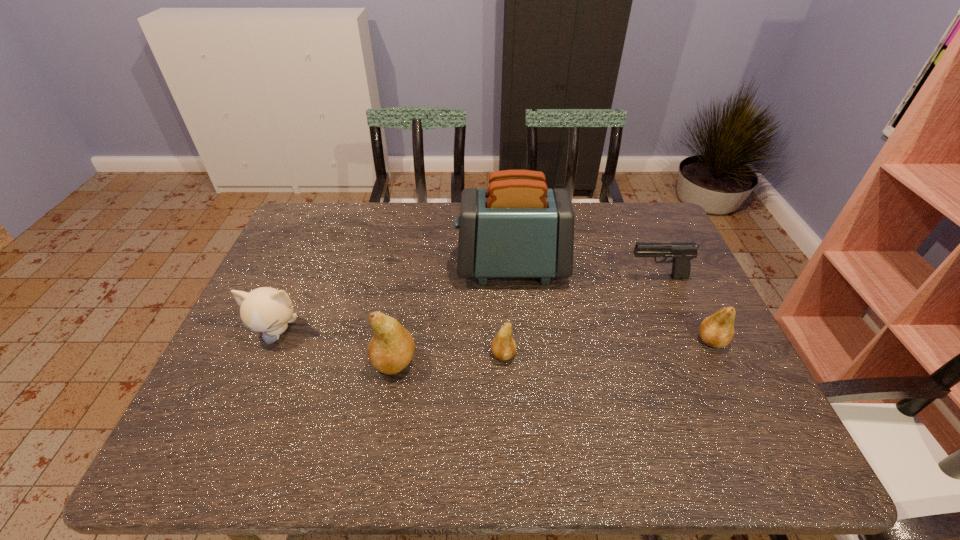
I want to click on blank space at the far edge, so click(370, 238).

Find the location of a particular element. The width and height of the screenshot is (960, 540). free point at the near edge is located at coordinates (294, 404).

In the image, there is a desktop. At what (x,y) coordinates should I click in order to perform the action: click on free space at the right edge. Please return your answer as a coordinate pair (x, y). The height and width of the screenshot is (540, 960). Looking at the image, I should click on tap(740, 380).

Identify the location of free spot at the far left corner of the desktop. (305, 205).

The height and width of the screenshot is (540, 960). In order to click on vacant space at the far right corner of the desktop in this screenshot , I will do `click(625, 201)`.

Where is `empty space that is in between the pistol and the rightmost pear`? empty space that is in between the pistol and the rightmost pear is located at coordinates (684, 309).

The width and height of the screenshot is (960, 540). What are the coordinates of `vacant area between the leftmost object and the second tallest object` in the screenshot? It's located at (335, 347).

Locate an element on the screen. This screenshot has width=960, height=540. free space between the toaster and the second shortest pear is located at coordinates (612, 304).

Where is `empty space that is in between the tallest object and the rightmost pear`? empty space that is in between the tallest object and the rightmost pear is located at coordinates (612, 304).

The width and height of the screenshot is (960, 540). In order to click on vacant space that's between the shortest pear and the toaster in this screenshot , I will do `click(508, 311)`.